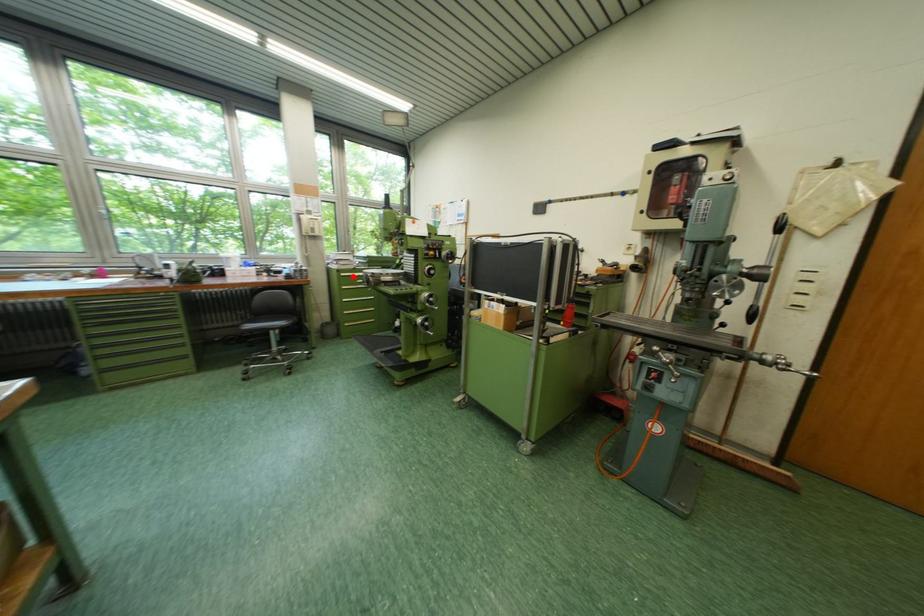
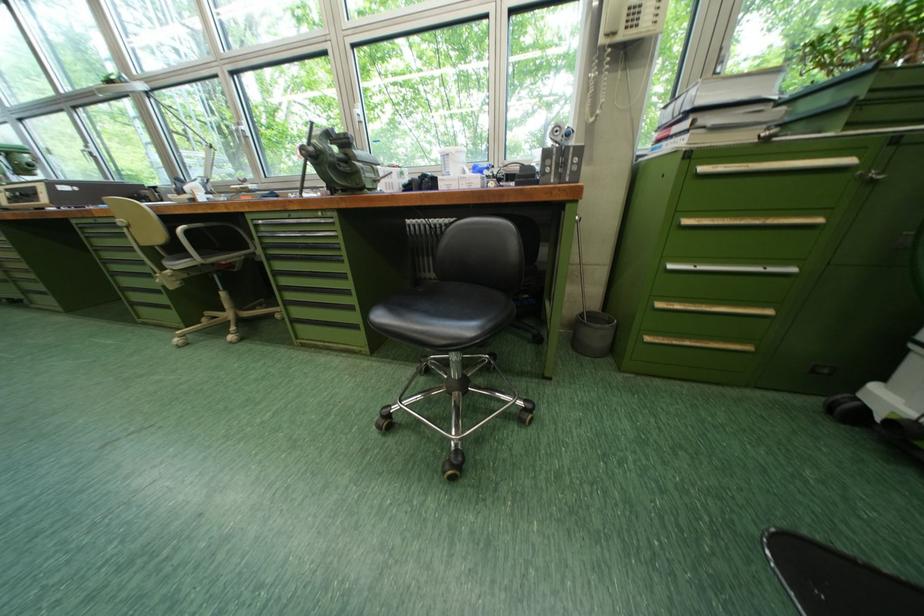
In the second image, find the point that corresponds to the highlighted location in the first image.

(713, 169)